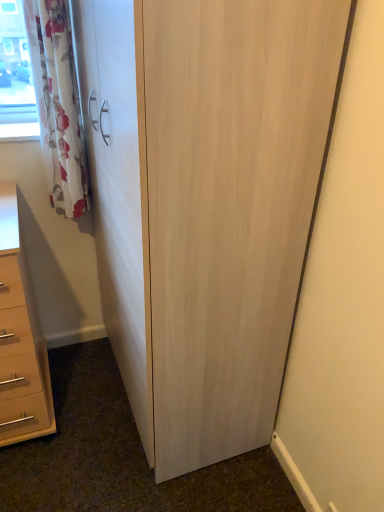
Question: Does white floral fabric curtain at upper left have a lesser width compared to matte beige chest of drawers at lower left?

Choices:
 (A) yes
 (B) no

Answer: (A)

Question: Could matte beige chest of drawers at lower left be considered to be inside white floral fabric curtain at upper left?

Choices:
 (A) yes
 (B) no

Answer: (B)

Question: From the image's perspective, is white floral fabric curtain at upper left on matte beige chest of drawers at lower left?

Choices:
 (A) yes
 (B) no

Answer: (A)

Question: Considering the relative sizes of white floral fabric curtain at upper left and matte beige chest of drawers at lower left in the image provided, is white floral fabric curtain at upper left bigger than matte beige chest of drawers at lower left?

Choices:
 (A) yes
 (B) no

Answer: (B)

Question: From a real-world perspective, is white floral fabric curtain at upper left over matte beige chest of drawers at lower left?

Choices:
 (A) no
 (B) yes

Answer: (B)

Question: Does white floral fabric curtain at upper left turn towards matte beige chest of drawers at lower left?

Choices:
 (A) no
 (B) yes

Answer: (A)

Question: Is the depth of matte beige chest of drawers at lower left greater than that of light wood cupboard at center?

Choices:
 (A) yes
 (B) no

Answer: (A)

Question: Is matte beige chest of drawers at lower left at the left side of light wood cupboard at center?

Choices:
 (A) yes
 (B) no

Answer: (A)

Question: Would you say matte beige chest of drawers at lower left contains light wood cupboard at center?

Choices:
 (A) yes
 (B) no

Answer: (B)

Question: Considering the relative sizes of matte beige chest of drawers at lower left and light wood cupboard at center in the image provided, is matte beige chest of drawers at lower left thinner than light wood cupboard at center?

Choices:
 (A) yes
 (B) no

Answer: (B)

Question: Is matte beige chest of drawers at lower left placed right next to light wood cupboard at center?

Choices:
 (A) no
 (B) yes

Answer: (A)

Question: Considering the relative sizes of matte beige chest of drawers at lower left and light wood cupboard at center in the image provided, is matte beige chest of drawers at lower left shorter than light wood cupboard at center?

Choices:
 (A) no
 (B) yes

Answer: (B)

Question: Is light wood cupboard at center to the left of matte beige chest of drawers at lower left from the viewer's perspective?

Choices:
 (A) no
 (B) yes

Answer: (A)